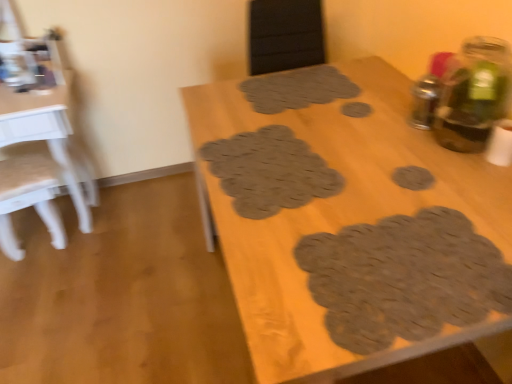
Where is `blank space to the left of metallic silver bottle at upper right, the second bottle viewed from the front`? This screenshot has width=512, height=384. blank space to the left of metallic silver bottle at upper right, the second bottle viewed from the front is located at coordinates (x=372, y=130).